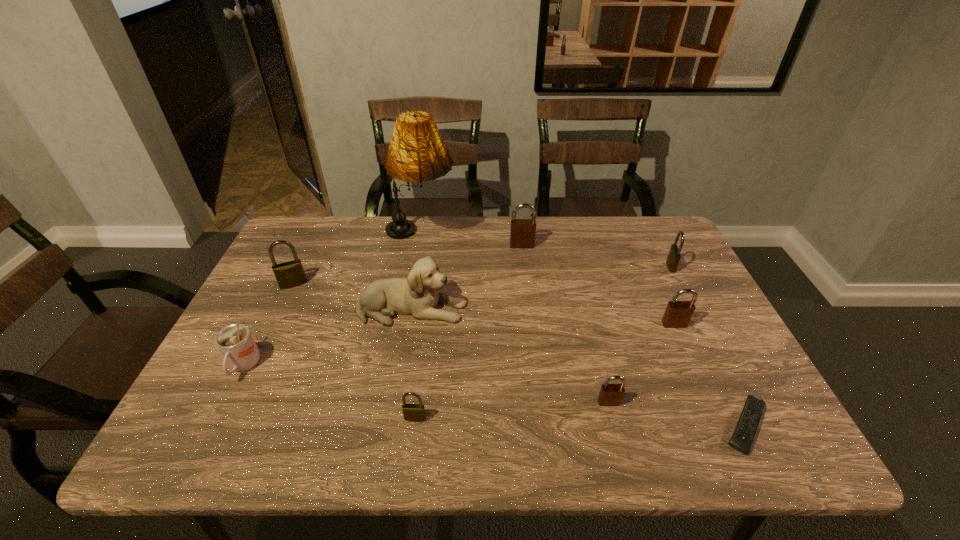
At what (x,y) coordinates should I click in order to perform the action: click on cup. Please return your answer as a coordinate pair (x, y). The height and width of the screenshot is (540, 960). Looking at the image, I should click on (235, 342).

Find the location of a particular element. The width and height of the screenshot is (960, 540). the fifth padlock from right to left is located at coordinates (412, 412).

Where is `the nearest padlock`? The width and height of the screenshot is (960, 540). the nearest padlock is located at coordinates (412, 412).

This screenshot has height=540, width=960. Find the location of `the second brown padlock from left to right`. the second brown padlock from left to right is located at coordinates (610, 394).

Find the location of `the seventh object from left to right`. the seventh object from left to right is located at coordinates (610, 394).

Where is `remote control`? The width and height of the screenshot is (960, 540). remote control is located at coordinates (744, 434).

The image size is (960, 540). In order to click on vacant region located on the front-facing side of the tallest object in this screenshot , I will do `click(475, 235)`.

Where is `vacant space situated 0.390m on the front-facing side of the puppy`? The width and height of the screenshot is (960, 540). vacant space situated 0.390m on the front-facing side of the puppy is located at coordinates (616, 308).

This screenshot has width=960, height=540. In order to click on free space located on the right of the second farthest brass padlock in this screenshot , I will do 335,284.

Where is `free spot located on the front-facing side of the farthest brown padlock`? This screenshot has height=540, width=960. free spot located on the front-facing side of the farthest brown padlock is located at coordinates (530, 317).